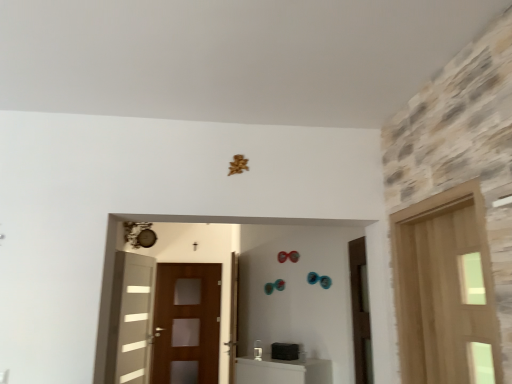
Question: Should I look upward or downward to see light wood door at right, which is counted as the fourth door, starting from the left?

Choices:
 (A) down
 (B) up

Answer: (A)

Question: Does brown wooden screen door at center have a greater height compared to wooden door at center, which is the 3th door from right to left?

Choices:
 (A) yes
 (B) no

Answer: (A)

Question: Is brown wooden screen door at center positioned behind wooden door at center, which is the 3th door from right to left?

Choices:
 (A) no
 (B) yes

Answer: (B)

Question: Considering the relative sizes of brown wooden screen door at center and wooden door at center, the second door when ordered from back to front, in the image provided, is brown wooden screen door at center thinner than wooden door at center, the second door when ordered from back to front,?

Choices:
 (A) no
 (B) yes

Answer: (B)

Question: From the image's perspective, does brown wooden screen door at center appear lower than wooden door at center, the second door when ordered from back to front?

Choices:
 (A) no
 (B) yes

Answer: (B)

Question: Is brown wooden screen door at center wider than wooden door at center, which ranks as the 2th door in left-to-right order?

Choices:
 (A) no
 (B) yes

Answer: (A)

Question: Is brown wooden screen door at center bigger than wooden door at center, the 3th door positioned from the front?

Choices:
 (A) yes
 (B) no

Answer: (A)

Question: Could you tell me if brown wooden screen door at center is turned towards white glossy door at left, placed as the first door when sorted from left to right?

Choices:
 (A) yes
 (B) no

Answer: (A)

Question: Is white glossy door at left, which appears as the first door when viewed from the back, at the back of brown wooden screen door at center?

Choices:
 (A) yes
 (B) no

Answer: (B)

Question: Considering the relative sizes of brown wooden screen door at center and white glossy door at left, arranged as the 4th door when viewed from the right, in the image provided, is brown wooden screen door at center smaller than white glossy door at left, arranged as the 4th door when viewed from the right,?

Choices:
 (A) yes
 (B) no

Answer: (B)

Question: Is brown wooden screen door at center not within white glossy door at left, which appears as the first door when viewed from the back?

Choices:
 (A) no
 (B) yes

Answer: (B)

Question: Is brown wooden screen door at center taller than white glossy door at left, arranged as the 4th door when viewed from the right?

Choices:
 (A) yes
 (B) no

Answer: (A)

Question: Considering the relative positions of brown wooden screen door at center and white glossy door at left, placed as the first door when sorted from left to right, in the image provided, is brown wooden screen door at center to the right of white glossy door at left, placed as the first door when sorted from left to right, from the viewer's perspective?

Choices:
 (A) no
 (B) yes

Answer: (B)

Question: Is brown matte door at right, which is counted as the second door, starting from the right, taller than brown wooden screen door at center?

Choices:
 (A) no
 (B) yes

Answer: (A)